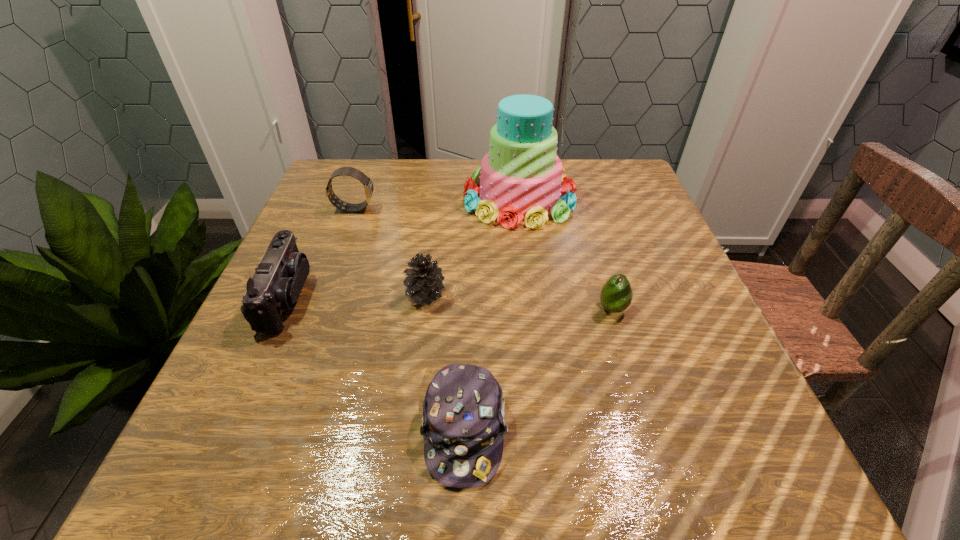
Locate an element on the screen. the tallest object is located at coordinates (520, 177).

The image size is (960, 540). I want to click on watch, so click(x=348, y=171).

Where is `pinecone`? pinecone is located at coordinates (424, 281).

Find the location of a particular element. The image size is (960, 540). camcorder is located at coordinates (277, 282).

At what (x,y) coordinates should I click in order to perform the action: click on avocado. Please return your answer as a coordinate pair (x, y). The image size is (960, 540). Looking at the image, I should click on (616, 295).

Locate an element on the screen. This screenshot has width=960, height=540. headwear is located at coordinates (463, 417).

Identify the location of free spot located on the right of the tallest object. Image resolution: width=960 pixels, height=540 pixels. pos(600,199).

Identify the location of vacant region located 0.230m on the face of the watch. The width and height of the screenshot is (960, 540). (471, 208).

Locate an element on the screen. The height and width of the screenshot is (540, 960). vacant region located on the left of the pinecone is located at coordinates (374, 295).

At what (x,y) coordinates should I click in order to perform the action: click on vacant space located 0.110m on the front-facing side of the camcorder. Please return your answer as a coordinate pair (x, y). This screenshot has width=960, height=540. Looking at the image, I should click on (364, 298).